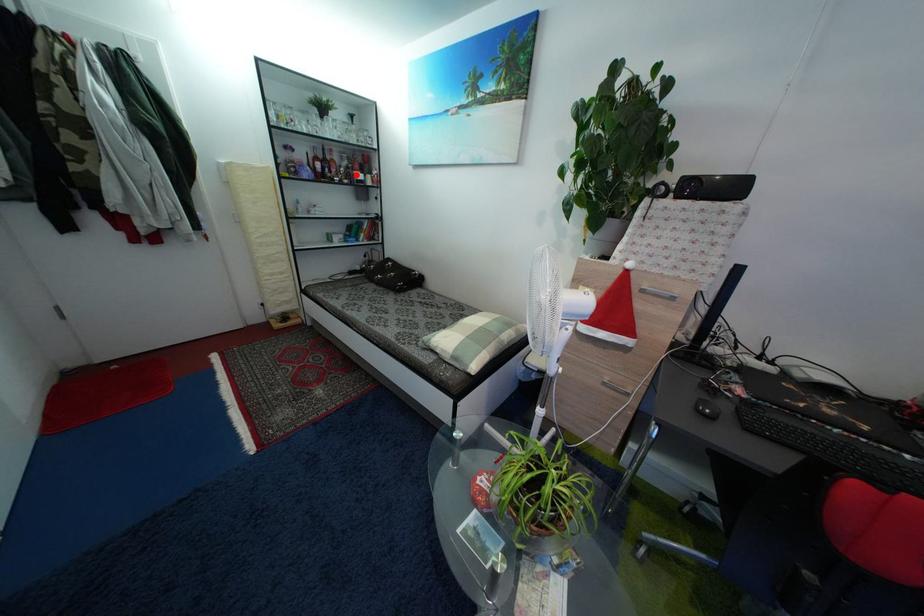
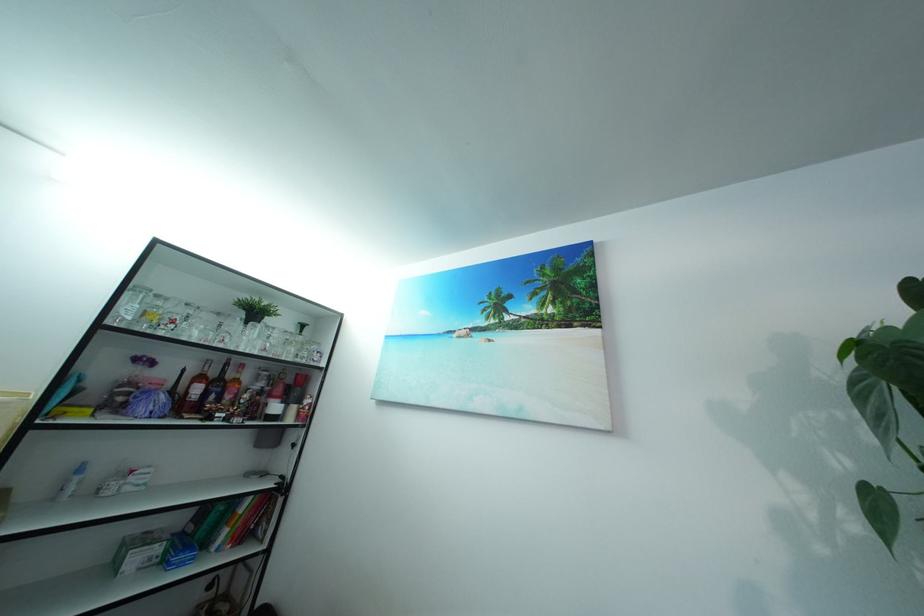
Where in the second image is the point corresponding to the highlighted location from the first image?

(269, 400)